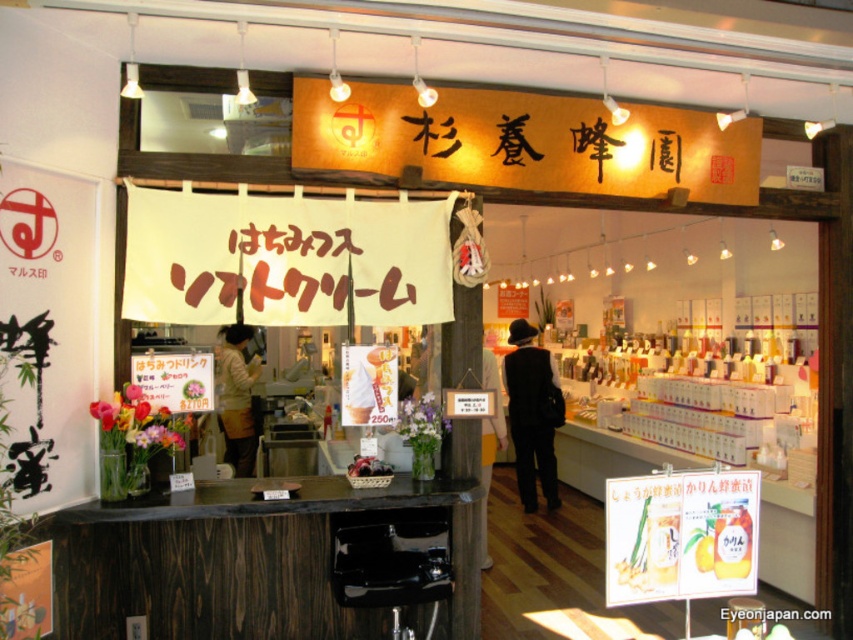
Consider the image. You are a customer entering the shop and see the black fabric coat at center and the black fabric at center. Which one is taller?

The black fabric coat at center is much taller than the black fabric at center.

You are a customer standing at the entrance of the Japanese honey shop. You see a light beige fabric jacket at center and a black fabric at center. Which fabric is closer to you?

The light beige fabric jacket at center is closer to you because it is further to the viewer than the black fabric at center.

You are a customer entering the Japanese honey shop and see the black fabric coat at center. Where should you place your coat?

The black fabric coat at center is located at point (x=531, y=413), so you should place your coat there.